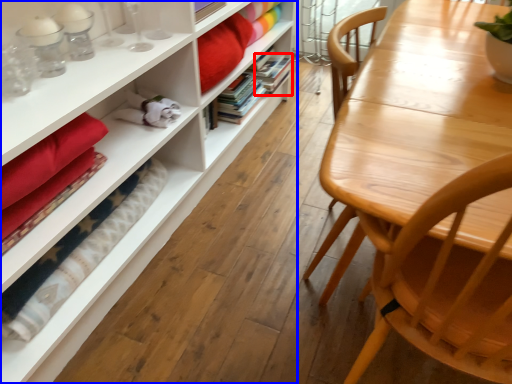
Question: Which of the following is the closest to the observer, book (highlighted by a red box) or bookcase (highlighted by a blue box)?

Choices:
 (A) book
 (B) bookcase

Answer: (B)